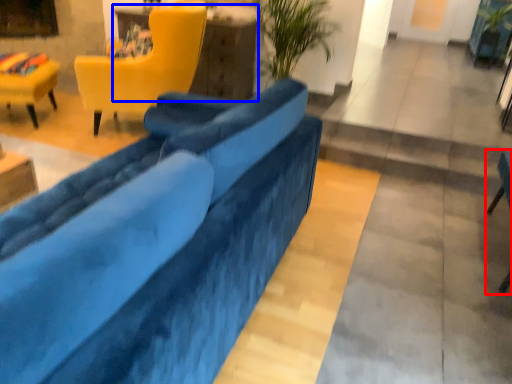
Question: Which of the following is the farthest to the observer, chair (highlighted by a red box) or table (highlighted by a blue box)?

Choices:
 (A) chair
 (B) table

Answer: (B)